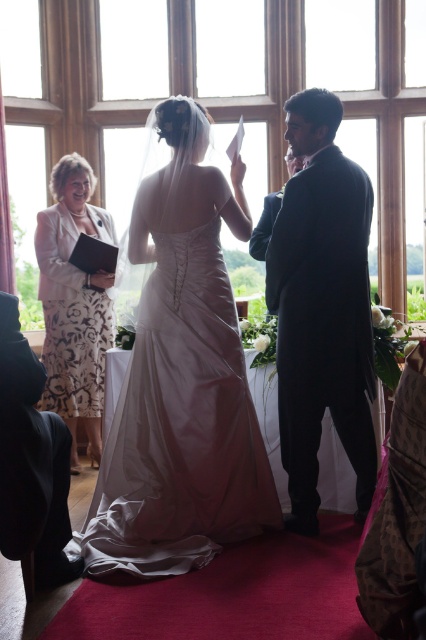
Question: Does white satin dress at center have a lesser width compared to matte black jacket at left?

Choices:
 (A) no
 (B) yes

Answer: (A)

Question: Which point is farther to the camera?

Choices:
 (A) white floral dress at left
 (B) white satin dress at center
 (C) matte black jacket at left
 (D) black satin suit at center

Answer: (A)

Question: Which object appears closest to the camera in this image?

Choices:
 (A) white floral dress at left
 (B) black satin suit at center
 (C) matte black jacket at left

Answer: (C)

Question: Can you confirm if white satin dress at center is bigger than white floral dress at left?

Choices:
 (A) no
 (B) yes

Answer: (B)

Question: Which point is closer to the camera?

Choices:
 (A) (6, 454)
 (B) (147, 177)
 (C) (317, 392)

Answer: (A)

Question: Is white satin dress at center thinner than matte black jacket at left?

Choices:
 (A) yes
 (B) no

Answer: (B)